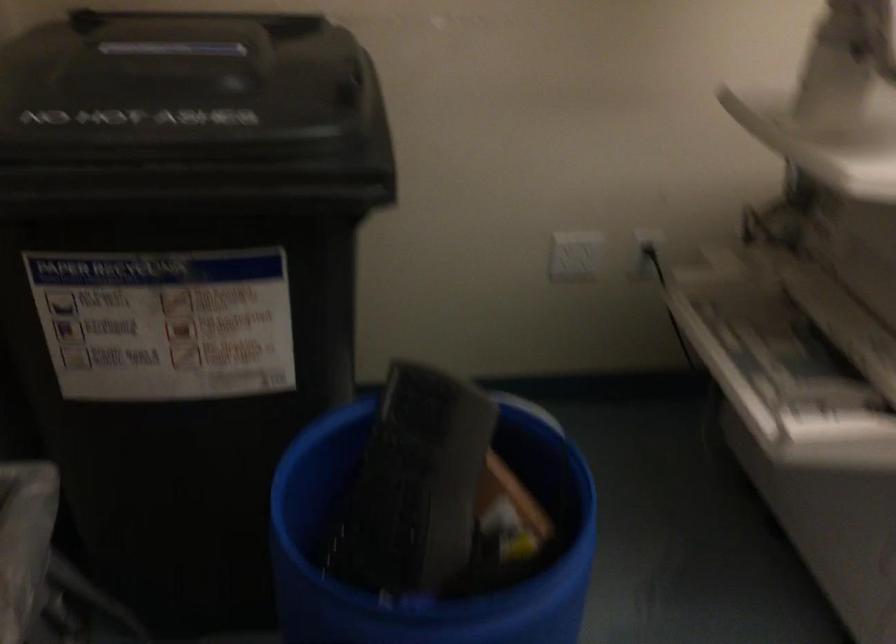
What do you see at coordinates (191, 93) in the screenshot? Image resolution: width=896 pixels, height=644 pixels. I see `the black bin lid` at bounding box center [191, 93].